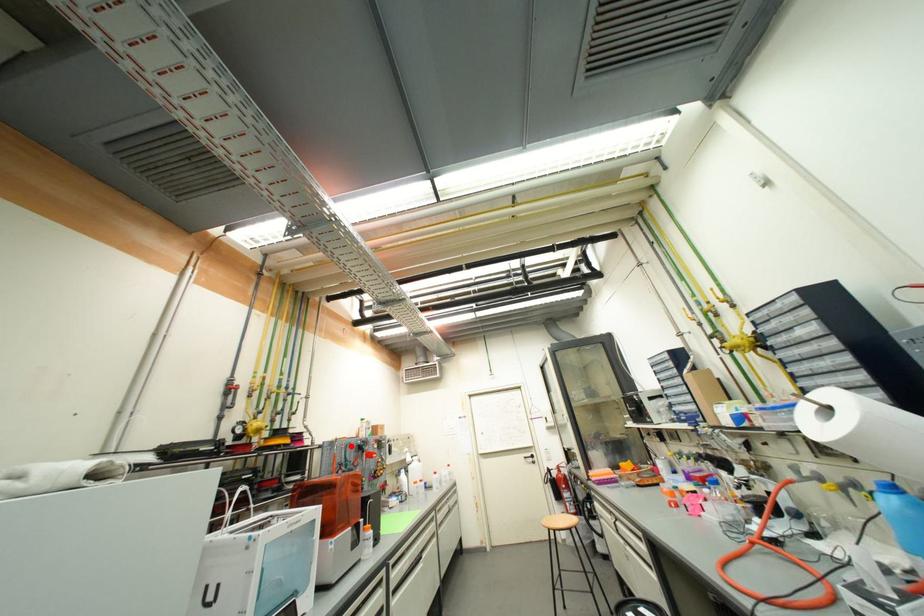
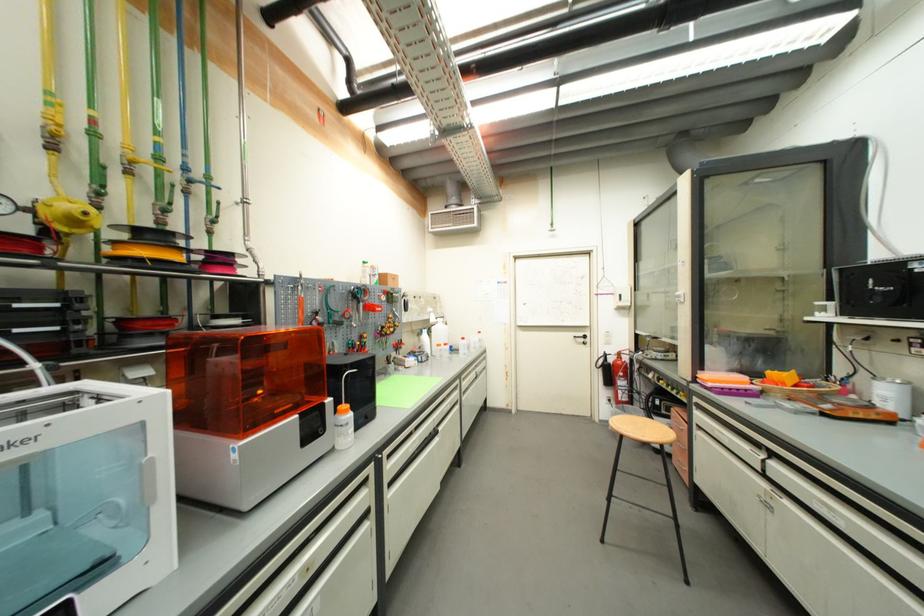
Question: I am providing you with two images of the same scene from different viewpoints. Given a red point in image1, look at the same physical point in image2. Is it:

Choices:
 (A) Closer to the viewpoint
 (B) Farther from the viewpoint

Answer: (A)